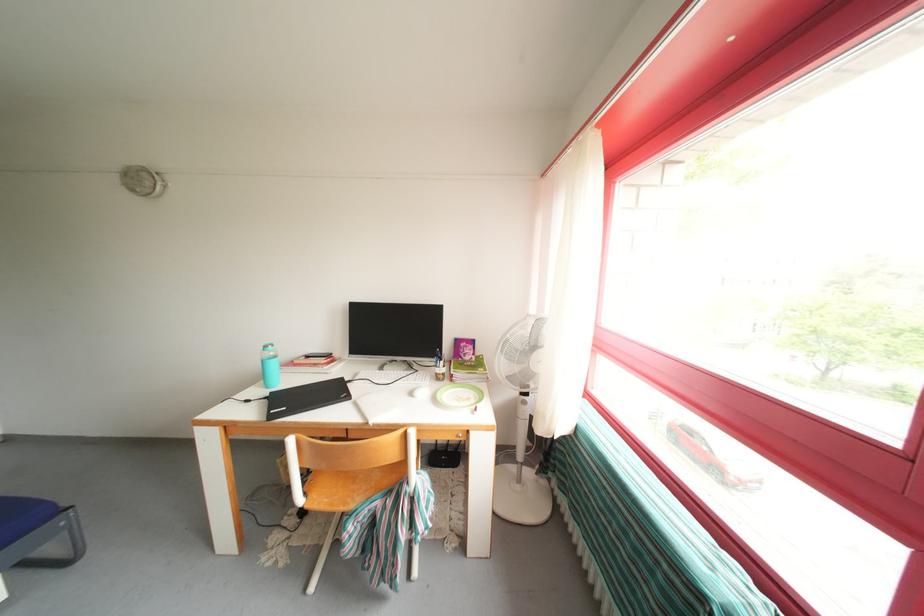
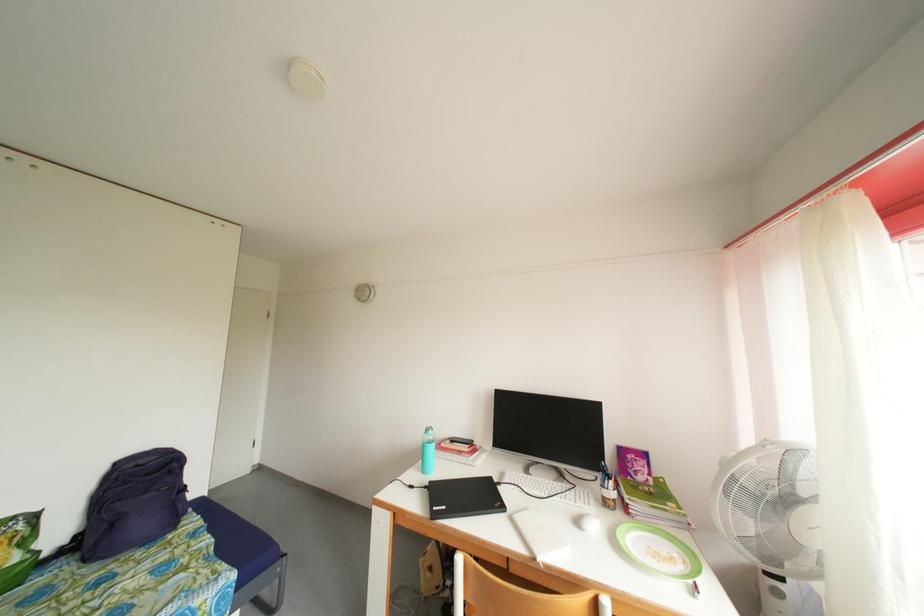
The point at (419, 399) is marked in the first image. Where is the corresponding point in the second image?

(585, 528)